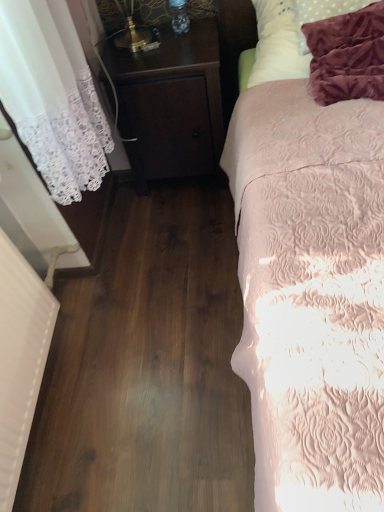
Find the location of a particular element. Image resolution: width=384 pixels, height=512 pixels. empty space that is ontop of dark wood nightstand at center (from a real-world perspective) is located at coordinates (155, 30).